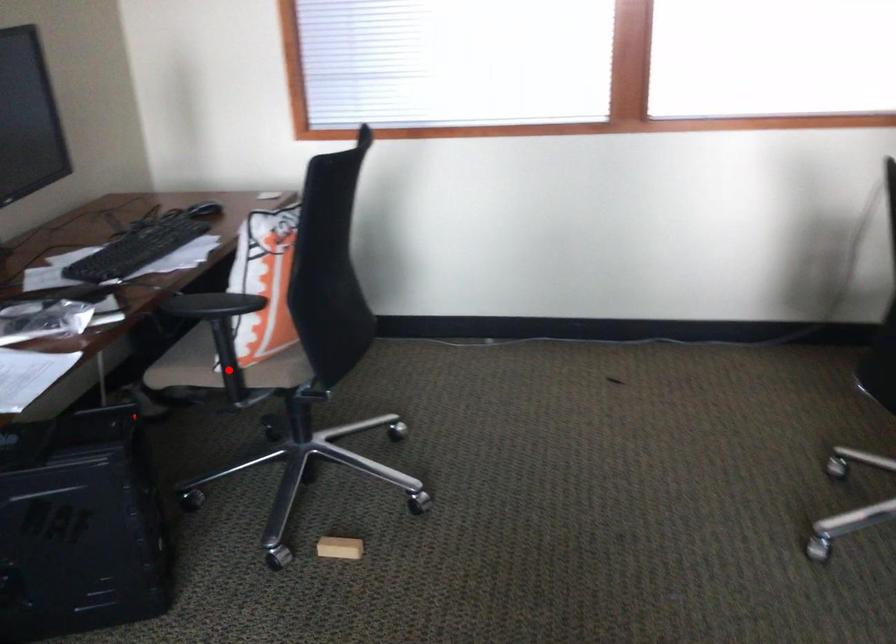
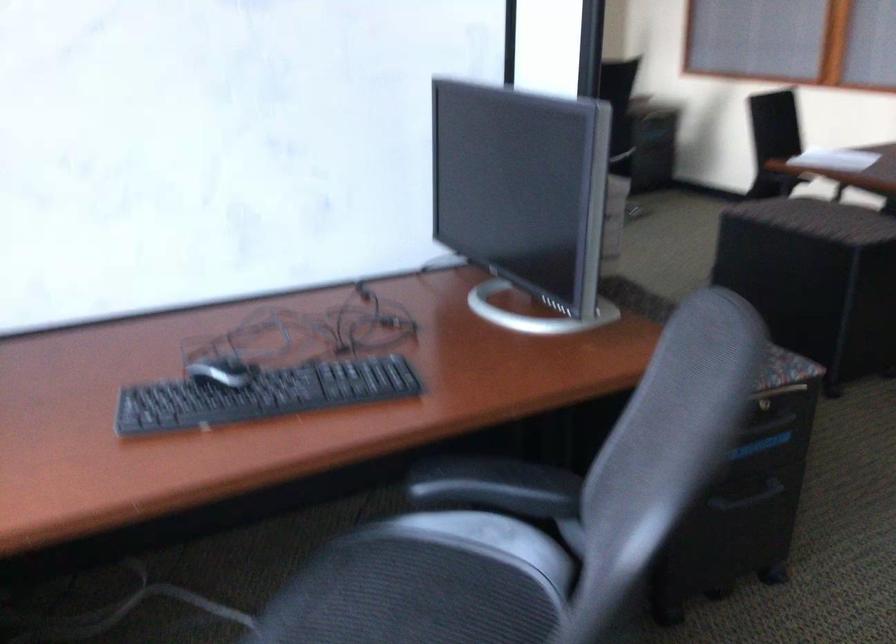
Question: I am providing you with two images of the same scene from different viewpoints. A red point is marked on the first image. At the location where the point appears in image 1, is it still visible in image 2?

Choices:
 (A) Yes
 (B) No

Answer: (B)